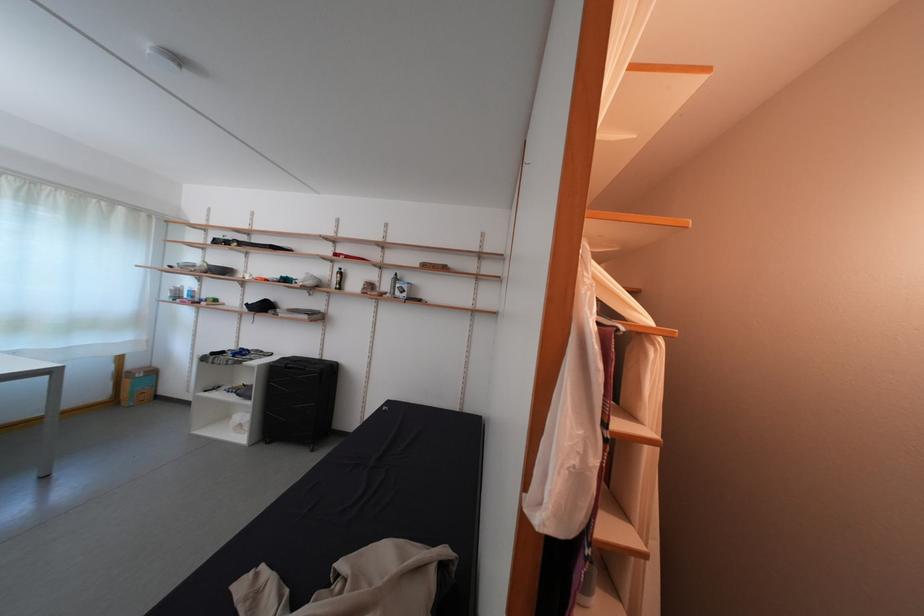
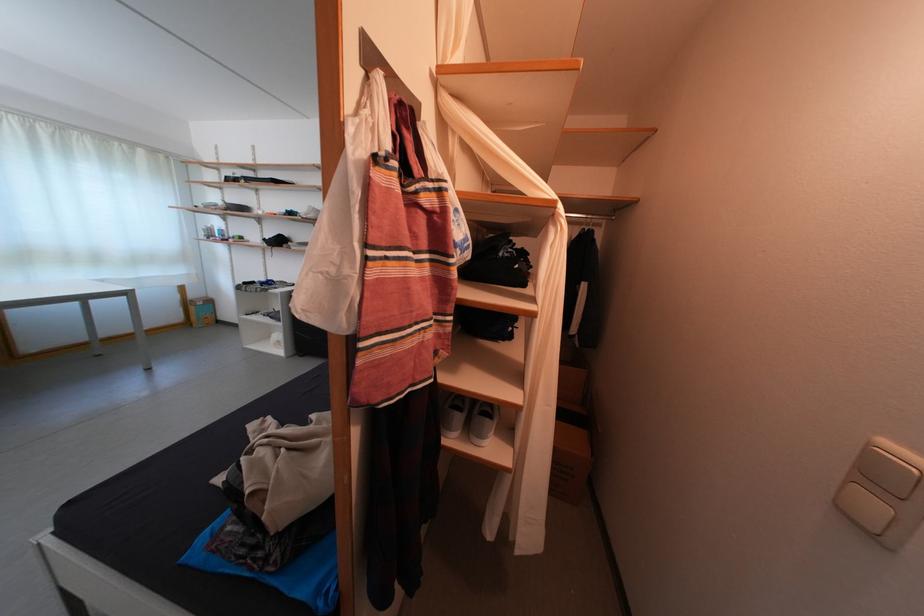
Locate, in the second image, the point that corresponds to point (140, 371) in the first image.

(201, 302)